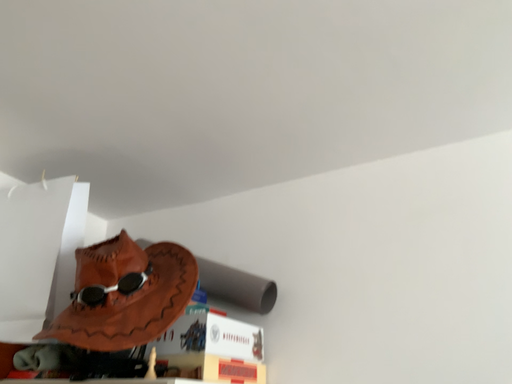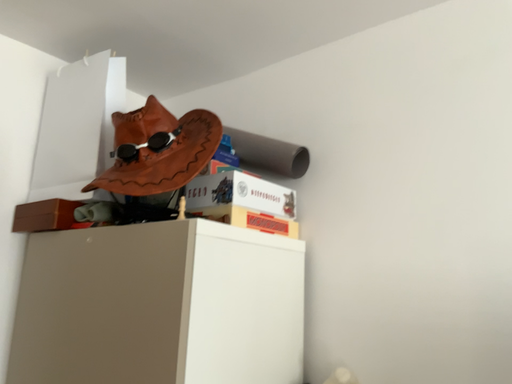
Question: How did the camera likely rotate when shooting the video?

Choices:
 (A) rotated right
 (B) rotated left

Answer: (B)